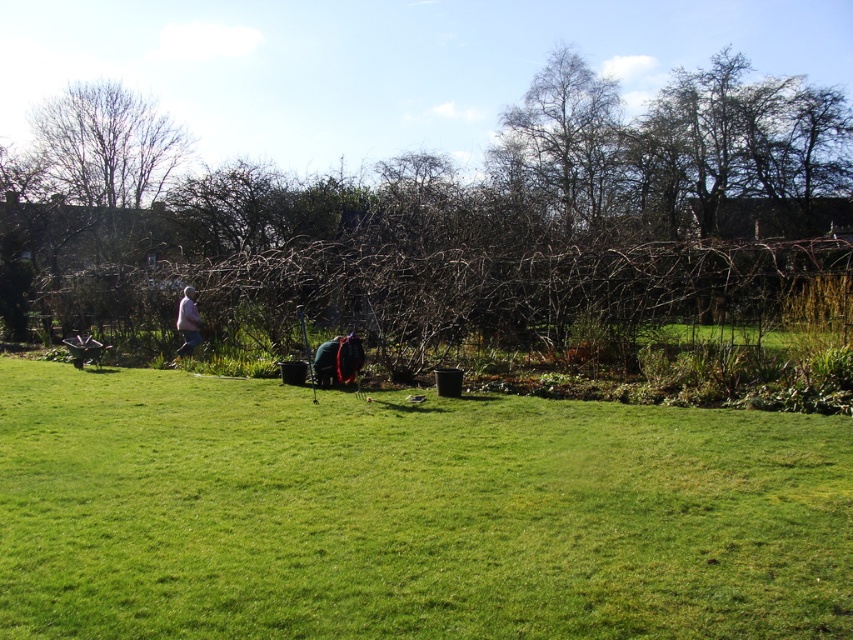
Question: Is brown leafless tree at center thinner than bare branches at upper center?

Choices:
 (A) yes
 (B) no

Answer: (B)

Question: Does green grassy at center have a greater width compared to light purple sweater at center?

Choices:
 (A) no
 (B) yes

Answer: (B)

Question: Which object is farther from the camera taking this photo?

Choices:
 (A) brown leafless tree at center
 (B) green grassy at center
 (C) bare branches at upper center
 (D) light purple sweater at center

Answer: (C)

Question: Is green grassy at center thinner than light purple sweater at center?

Choices:
 (A) no
 (B) yes

Answer: (A)

Question: Which object is closer to the camera taking this photo?

Choices:
 (A) light purple sweater at center
 (B) bare branches at upper center
 (C) green grassy at center
 (D) brown leafless tree at center

Answer: (C)

Question: Among these objects, which one is nearest to the camera?

Choices:
 (A) light purple sweater at center
 (B) brown leafless tree at center

Answer: (B)